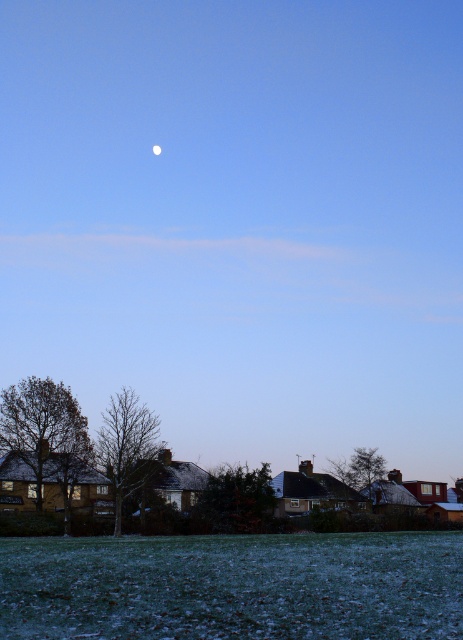
Question: Which object is the closest to the bare branches at center?

Choices:
 (A) green leafy tree at center
 (B) brown leafless tree at lower left
 (C) green matte tree at center

Answer: (B)

Question: Observing the image, what is the correct spatial positioning of green frosty grass at lower center in reference to bare branches at center?

Choices:
 (A) above
 (B) below

Answer: (A)

Question: Which object is farther from the camera taking this photo?

Choices:
 (A) green matte tree at center
 (B) green leafy tree at center
 (C) white glossy moon at upper center
 (D) bare branches at center

Answer: (C)

Question: Can you confirm if green matte tree at center is thinner than green leafy tree at center?

Choices:
 (A) yes
 (B) no

Answer: (A)

Question: Which point appears farthest from the camera in this image?

Choices:
 (A) (187, 616)
 (B) (262, 509)

Answer: (B)

Question: In this image, where is green frosty grass at lower center located relative to brown leafless tree at lower left?

Choices:
 (A) right
 (B) left

Answer: (A)